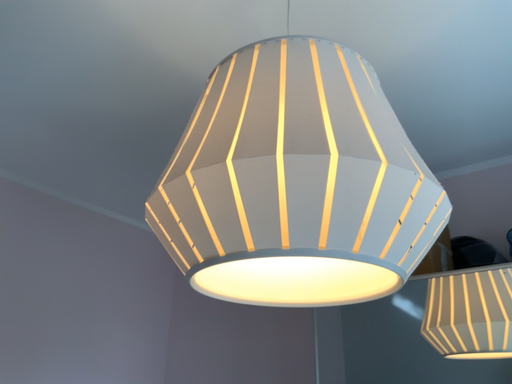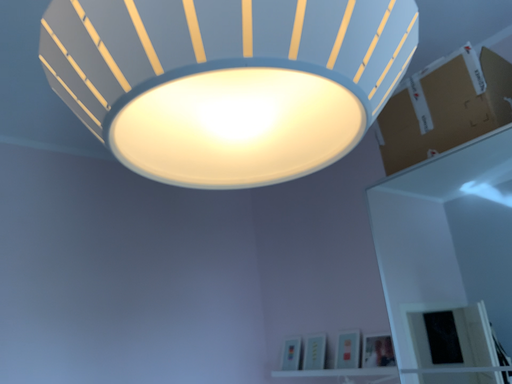
Question: How did the camera likely rotate when shooting the video?

Choices:
 (A) rotated downward
 (B) rotated upward

Answer: (A)